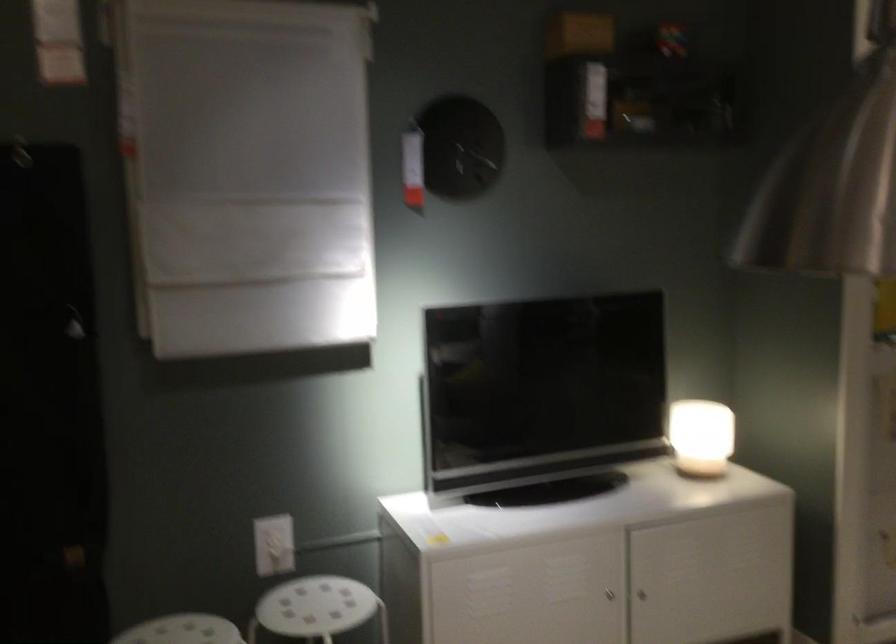
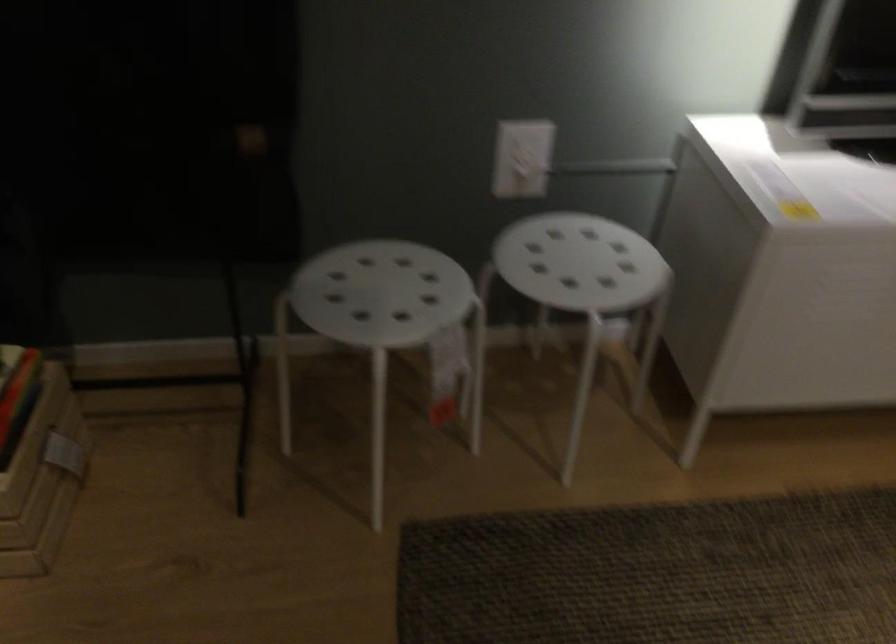
Question: How did the camera likely rotate?

Choices:
 (A) Left
 (B) Right
 (C) Up
 (D) Down

Answer: (D)